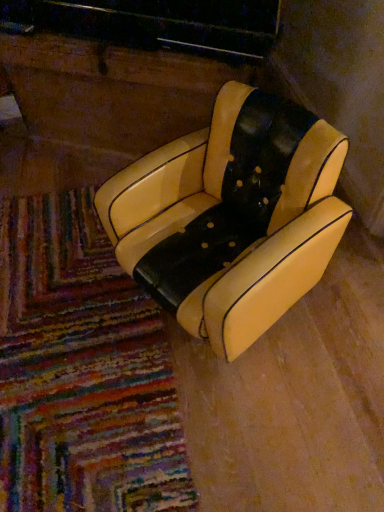
Identify the location of yellow leather armchair at center. This screenshot has height=512, width=384. point(232,216).

What is the approximate height of yellow leather armchair at center?

It is 22.37 inches.

The image size is (384, 512). What do you see at coordinates (232, 216) in the screenshot? I see `yellow leather armchair at center` at bounding box center [232, 216].

At what (x,y) coordinates should I click in order to perform the action: click on yellow leather armchair at center. Please return your answer as a coordinate pair (x, y). This screenshot has height=512, width=384. Looking at the image, I should click on point(232,216).